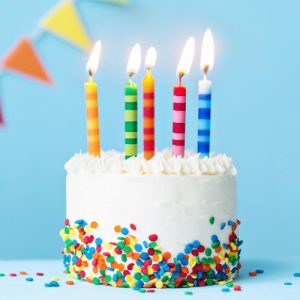
At what (x,y) coordinates should I click in order to perform the action: click on birthday candles. Please return your answer as a coordinate pair (x, y). The image size is (300, 300). Looking at the image, I should click on (91, 130), (133, 137), (153, 131), (176, 129), (203, 132).